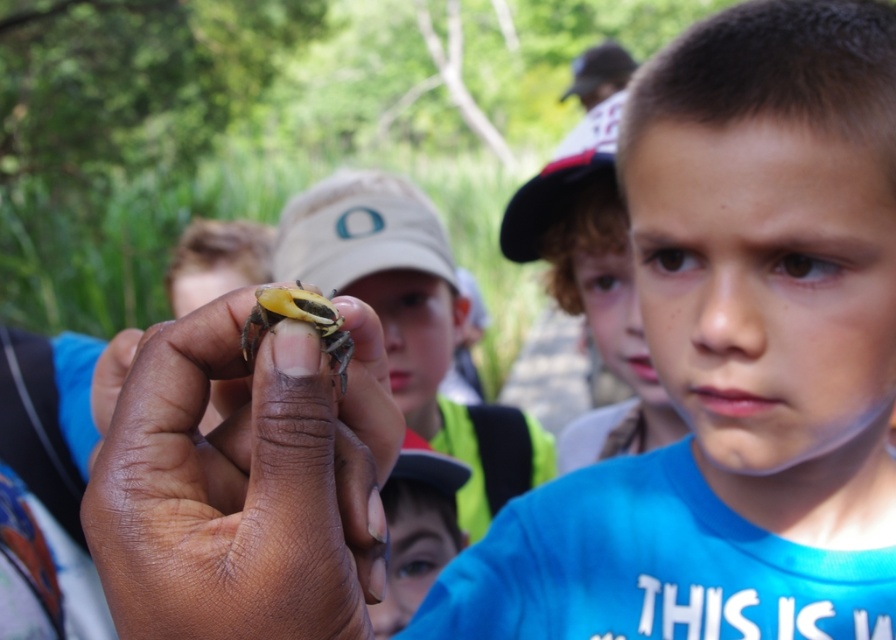
Question: Is curly-haired boy at center bigger than smooth skin face at center?

Choices:
 (A) no
 (B) yes

Answer: (B)

Question: Can you confirm if smooth skin hand at center is positioned above yellow matte insect at center?

Choices:
 (A) no
 (B) yes

Answer: (A)

Question: Which of the following is the farthest from the observer?

Choices:
 (A) smooth skin face at center
 (B) smooth yellow frog at center
 (C) yellow matte insect at center
 (D) blue matte shirt at center

Answer: (B)

Question: Which object appears closest to the camera in this image?

Choices:
 (A) curly-haired boy at center
 (B) smooth yellow frog at center
 (C) smooth skin hand at center
 (D) smooth skin face at center

Answer: (C)

Question: Which of these objects is positioned farthest from the curly-haired boy at center?

Choices:
 (A) smooth skin hand at center
 (B) yellow matte insect at center

Answer: (B)

Question: Does smooth skin face at center appear over yellow matte insect at center?

Choices:
 (A) no
 (B) yes

Answer: (A)